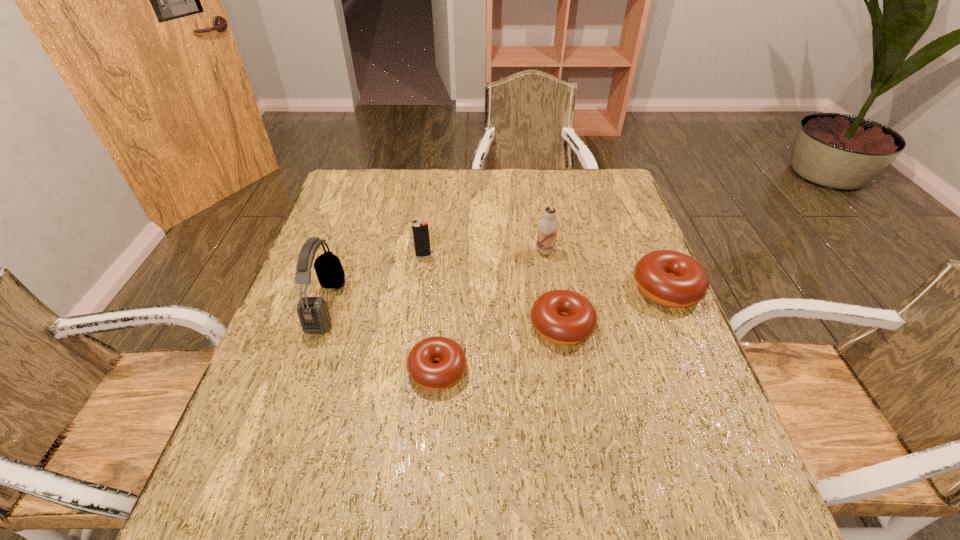
What are the coordinates of `the shortest doughnut` in the screenshot? It's located at (434, 376).

The height and width of the screenshot is (540, 960). I want to click on the leftmost doughnut, so click(x=434, y=376).

This screenshot has width=960, height=540. In order to click on the second doughnut from left to right in this screenshot , I will do pos(564,317).

You are a GUI agent. You are given a task and a screenshot of the screen. Output one action in this format:
    pyautogui.click(x=<x>, y=<y>)
    Task: Click on the second shortest doughnut
    
    Given the screenshot: What is the action you would take?
    pyautogui.click(x=564, y=317)

Find the location of a particular element. This screenshot has height=540, width=960. the rightmost object is located at coordinates (670, 278).

You are a GUI agent. You are given a task and a screenshot of the screen. Output one action in this format:
    pyautogui.click(x=<x>, y=<y>)
    Task: Click on the second tallest object
    The width and height of the screenshot is (960, 540).
    Given the screenshot: What is the action you would take?
    pyautogui.click(x=548, y=226)

In order to click on the fourth shortest object in this screenshot , I will do `click(420, 229)`.

You are a GUI agent. You are given a task and a screenshot of the screen. Output one action in this format:
    pyautogui.click(x=<x>, y=<y>)
    Task: Click on the tallest object
    The width and height of the screenshot is (960, 540).
    Given the screenshot: What is the action you would take?
    pyautogui.click(x=314, y=317)

The height and width of the screenshot is (540, 960). Find the location of `the leftmost object`. the leftmost object is located at coordinates (314, 317).

You are a GUI agent. You are given a task and a screenshot of the screen. Output one action in this format:
    pyautogui.click(x=<x>, y=<y>)
    Task: Click on the vacant space situated 0.070m on the left of the shortest object
    This screenshot has height=540, width=960.
    Given the screenshot: What is the action you would take?
    pyautogui.click(x=375, y=369)